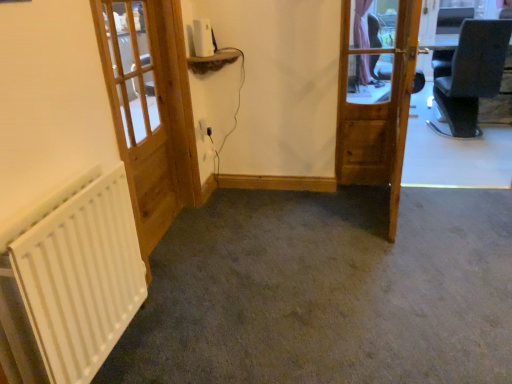
At what (x,y) coordinates should I click in order to perform the action: click on white plastic electric outlet at center. Please return your answer as a coordinate pair (x, y). Looking at the image, I should click on (204, 128).

In order to face white matte radiator at lower left, should I rotate leftwards or rightwards?

To align with it, rotate left about 21.384°.

I want to click on white wooden door at left, marked as the second door in a right-to-left arrangement, so click(x=149, y=109).

Does white wooden door at left, which is the first door in left-to-right order, appear on the right side of white matte radiator at lower left?

Yes.

Could you tell me if white wooden door at left, marked as the second door in a right-to-left arrangement, is turned towards white matte radiator at lower left?

No, white wooden door at left, marked as the second door in a right-to-left arrangement, is not aimed at white matte radiator at lower left.

From a real-world perspective, which is physically above, white wooden door at left, marked as the second door in a right-to-left arrangement, or white matte radiator at lower left?

white wooden door at left, marked as the second door in a right-to-left arrangement.

From the image's perspective, which is below, white wooden door at left, which is the first door in left-to-right order, or white matte radiator at lower left?

white matte radiator at lower left is shown below in the image.

Is white matte radiator at lower left aimed at white plastic electric outlet at center?

No, white matte radiator at lower left is not turned towards white plastic electric outlet at center.

From the image's perspective, is white matte radiator at lower left on top of white plastic electric outlet at center?

No, from the image's perspective, white matte radiator at lower left is not above white plastic electric outlet at center.

From a real-world perspective, is white matte radiator at lower left physically above white plastic electric outlet at center?

Actually, white matte radiator at lower left is physically below white plastic electric outlet at center in the real world.

Which is more to the right, white matte radiator at lower left or white plastic electric outlet at center?

Positioned to the right is white plastic electric outlet at center.

From the image's perspective, is wooden door at center, the first door from the right, beneath white plastic electric outlet at center?

Yes.

Based on the photo, which object is wider, wooden door at center, the first door from the right, or white plastic electric outlet at center?

wooden door at center, the first door from the right, is wider.

What's the angular difference between wooden door at center, the first door from the right, and white plastic electric outlet at center's facing directions?

6.93 degrees separate the facing orientations of wooden door at center, the first door from the right, and white plastic electric outlet at center.

Consider the image. Is wooden door at center, acting as the second door starting from the left, facing away from white matte radiator at lower left?

No, wooden door at center, acting as the second door starting from the left, is not facing the opposite direction of white matte radiator at lower left.

From a real-world perspective, relative to white matte radiator at lower left, is wooden door at center, acting as the second door starting from the left, vertically above or below?

wooden door at center, acting as the second door starting from the left, is above white matte radiator at lower left.

Is wooden door at center, acting as the second door starting from the left, positioned before white matte radiator at lower left?

No, wooden door at center, acting as the second door starting from the left, is further to the viewer.

From the image's perspective, is wooden door at center, the first door from the right, on top of white matte radiator at lower left?

Correct, wooden door at center, the first door from the right, appears higher than white matte radiator at lower left in the image.

Measure the distance from white matte radiator at lower left to wooden door at center, the first door from the right.

white matte radiator at lower left and wooden door at center, the first door from the right, are 5.25 feet apart from each other.

Considering the positions of objects white matte radiator at lower left and wooden door at center, acting as the second door starting from the left, in the image provided, who is more to the left, white matte radiator at lower left or wooden door at center, acting as the second door starting from the left,?

white matte radiator at lower left is more to the left.

Between white matte radiator at lower left and wooden door at center, acting as the second door starting from the left, which one has more height?

wooden door at center, acting as the second door starting from the left, is taller.

How different are the orientations of white matte radiator at lower left and wooden door at center, the first door from the right, in degrees?

7.91 degrees separate the facing orientations of white matte radiator at lower left and wooden door at center, the first door from the right.

From a real-world perspective, is white matte radiator at lower left on top of white wooden door at left, which is the first door in left-to-right order?

No, from a real-world perspective, white matte radiator at lower left is not above white wooden door at left, which is the first door in left-to-right order.

Based on the photo, can you confirm if white matte radiator at lower left is taller than white wooden door at left, which is the first door in left-to-right order?

No, white matte radiator at lower left is not taller than white wooden door at left, which is the first door in left-to-right order.

Can you confirm if white matte radiator at lower left is smaller than white wooden door at left, which is the first door in left-to-right order?

Correct, white matte radiator at lower left occupies less space than white wooden door at left, which is the first door in left-to-right order.

Consider the image. Between white matte radiator at lower left and white wooden door at left, marked as the second door in a right-to-left arrangement, which one is positioned in front?

white matte radiator at lower left is in front.

Would you consider white plastic electric outlet at center to be distant from wooden door at center, the first door from the right?

Indeed, white plastic electric outlet at center is not near wooden door at center, the first door from the right.

Based on the photo, could you tell me if white plastic electric outlet at center is facing wooden door at center, acting as the second door starting from the left?

Yes.

There is a white plastic electric outlet at center. Identify the location of the 1st door above it (from a real-world perspective). The image size is (512, 384). (378, 114).

At what (x,y) coordinates should I click in order to perform the action: click on door that is the 1st one when counting rightward from the white matte radiator at lower left. Please return your answer as a coordinate pair (x, y). Looking at the image, I should click on (149, 109).

At what (x,y) coordinates should I click in order to perform the action: click on electric outlet above the white matte radiator at lower left (from the image's perspective). Please return your answer as a coordinate pair (x, y). This screenshot has width=512, height=384. Looking at the image, I should click on (204, 128).

Based on the photo, based on their spatial positions, is white matte radiator at lower left or white plastic electric outlet at center closer to wooden door at center, the first door from the right?

white plastic electric outlet at center is positioned closer to the anchor wooden door at center, the first door from the right.

Based on their spatial positions, is white plastic electric outlet at center or wooden door at center, acting as the second door starting from the left, closer to white matte radiator at lower left?

wooden door at center, acting as the second door starting from the left, is positioned closer to the anchor white matte radiator at lower left.

When comparing their distances from white wooden door at left, which is the first door in left-to-right order, does wooden door at center, the first door from the right, or white plastic electric outlet at center seem further?

wooden door at center, the first door from the right, lies further to white wooden door at left, which is the first door in left-to-right order, than the other object.

Considering their positions, is white matte radiator at lower left positioned closer to white plastic electric outlet at center than white wooden door at left, which is the first door in left-to-right order?

white wooden door at left, which is the first door in left-to-right order.

Estimate the real-world distances between objects in this image. Which object is further from white matte radiator at lower left, white wooden door at left, marked as the second door in a right-to-left arrangement, or wooden door at center, acting as the second door starting from the left?

wooden door at center, acting as the second door starting from the left, lies further to white matte radiator at lower left than the other object.

Looking at the image, which one is located closer to white matte radiator at lower left, wooden door at center, acting as the second door starting from the left, or white plastic electric outlet at center?

wooden door at center, acting as the second door starting from the left, is positioned closer to the anchor white matte radiator at lower left.

Considering their positions, is wooden door at center, acting as the second door starting from the left, positioned closer to white wooden door at left, marked as the second door in a right-to-left arrangement, than white matte radiator at lower left?

Based on the image, white matte radiator at lower left appears to be nearer to white wooden door at left, marked as the second door in a right-to-left arrangement.

Estimate the real-world distances between objects in this image. Which object is further from white plastic electric outlet at center, white wooden door at left, which is the first door in left-to-right order, or white matte radiator at lower left?

white matte radiator at lower left is positioned further to the anchor white plastic electric outlet at center.

Locate an element on the screen. This screenshot has width=512, height=384. door between white matte radiator at lower left and wooden door at center, the first door from the right is located at coordinates (149, 109).

The width and height of the screenshot is (512, 384). In order to click on electric outlet between white wooden door at left, marked as the second door in a right-to-left arrangement, and wooden door at center, the first door from the right, from left to right in this screenshot , I will do point(204,128).